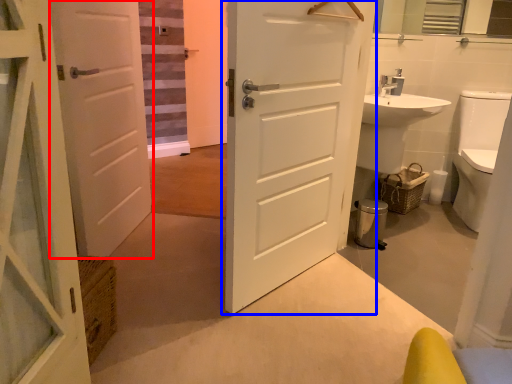
Question: Which point is closer to the camera, door (highlighted by a red box) or door (highlighted by a blue box)?

Choices:
 (A) door
 (B) door

Answer: (B)